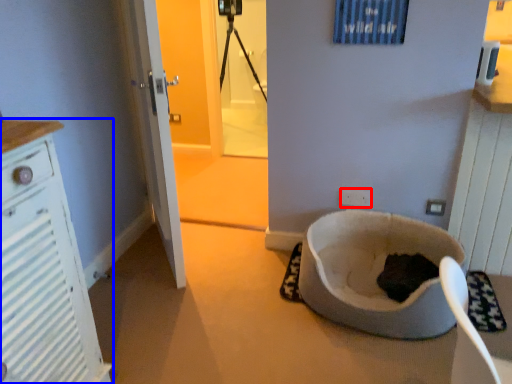
Question: Which object appears farthest to the camera in this image, electric outlet (highlighted by a red box) or cabinetry (highlighted by a blue box)?

Choices:
 (A) electric outlet
 (B) cabinetry

Answer: (A)